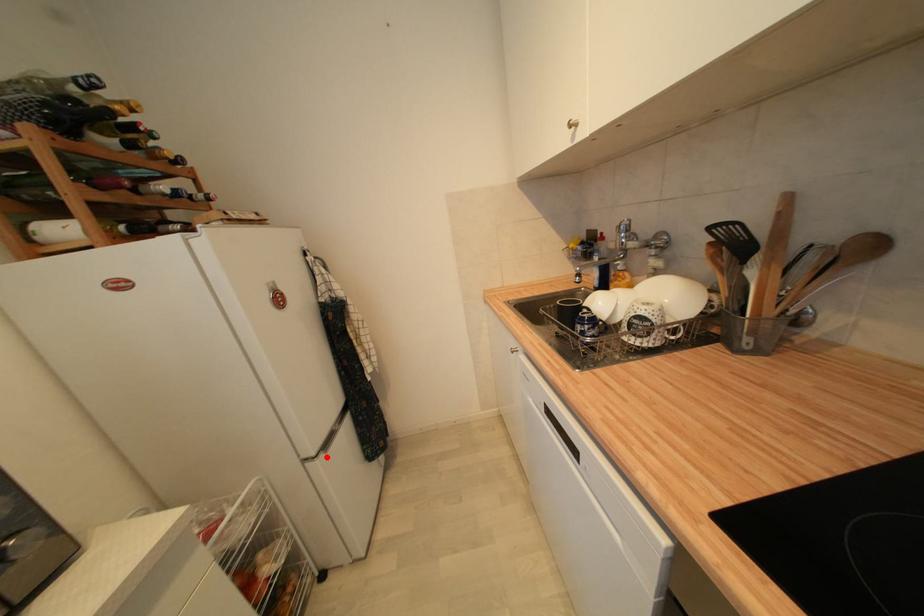
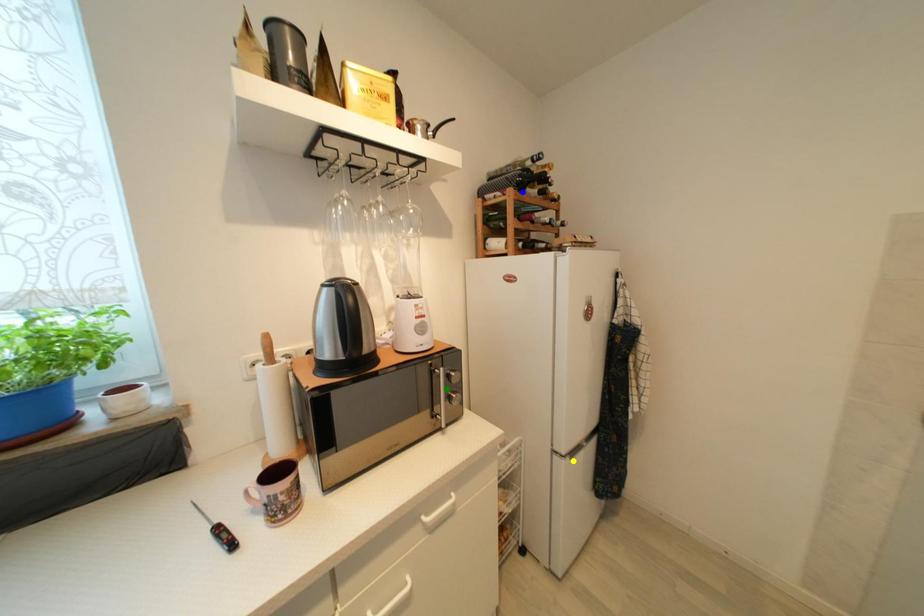
Question: I am providing you with two images of the same scene from different viewpoints. A red point is marked on the first image. You are given multiple points on the second image. Can you choose the point in image 2 that corresponds to the point in image 1?

Choices:
 (A) green point
 (B) yellow point
 (C) blue point

Answer: (B)